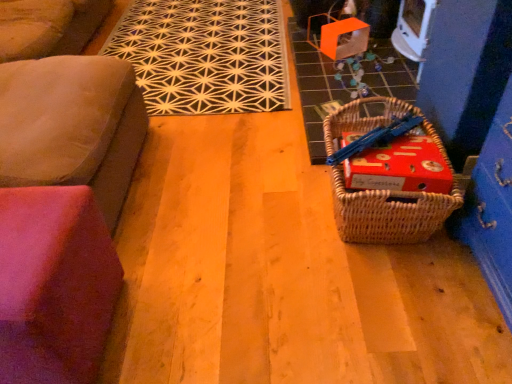
Question: Does black geometric rug at upper center turn towards woven brown picnic basket at lower right?

Choices:
 (A) no
 (B) yes

Answer: (A)

Question: From the image's perspective, is black geometric rug at upper center beneath woven brown picnic basket at lower right?

Choices:
 (A) no
 (B) yes

Answer: (A)

Question: Is black geometric rug at upper center shorter than woven brown picnic basket at lower right?

Choices:
 (A) yes
 (B) no

Answer: (A)

Question: From the image's perspective, is black geometric rug at upper center on top of woven brown picnic basket at lower right?

Choices:
 (A) yes
 (B) no

Answer: (A)

Question: Would you say woven brown picnic basket at lower right is part of black geometric rug at upper center's contents?

Choices:
 (A) yes
 (B) no

Answer: (B)

Question: In the image, is pink fabric cushion at lower left, the second furniture from the top, on the left side or the right side of suede couch at left, which appears as the second furniture when ordered from the bottom?

Choices:
 (A) right
 (B) left

Answer: (A)

Question: Does point (98, 352) appear closer or farther from the camera than point (102, 205)?

Choices:
 (A) closer
 (B) farther

Answer: (A)

Question: Is pink fabric cushion at lower left, the second furniture from the top, taller or shorter than suede couch at left, acting as the 1th furniture starting from the top?

Choices:
 (A) tall
 (B) short

Answer: (B)

Question: From a real-world perspective, relative to suede couch at left, which appears as the second furniture when ordered from the bottom, is pink fabric cushion at lower left, the second furniture from the top, vertically above or below?

Choices:
 (A) below
 (B) above

Answer: (A)

Question: Considering the positions of red cardboard box at lower right and suede couch at left, which appears as the second furniture when ordered from the bottom, in the image, is red cardboard box at lower right bigger or smaller than suede couch at left, which appears as the second furniture when ordered from the bottom,?

Choices:
 (A) big
 (B) small

Answer: (B)

Question: Is red cardboard box at lower right spatially inside suede couch at left, acting as the 1th furniture starting from the top, or outside of it?

Choices:
 (A) inside
 (B) outside

Answer: (B)

Question: Is red cardboard box at lower right in front of or behind suede couch at left, acting as the 1th furniture starting from the top, in the image?

Choices:
 (A) behind
 (B) front

Answer: (A)

Question: Is point (385, 145) positioned closer to the camera than point (11, 142)?

Choices:
 (A) closer
 (B) farther

Answer: (B)

Question: Does point (418, 205) appear closer or farther from the camera than point (245, 105)?

Choices:
 (A) farther
 (B) closer

Answer: (B)

Question: From the image's perspective, is woven brown picnic basket at lower right located above or below black geometric rug at upper center?

Choices:
 (A) above
 (B) below

Answer: (B)